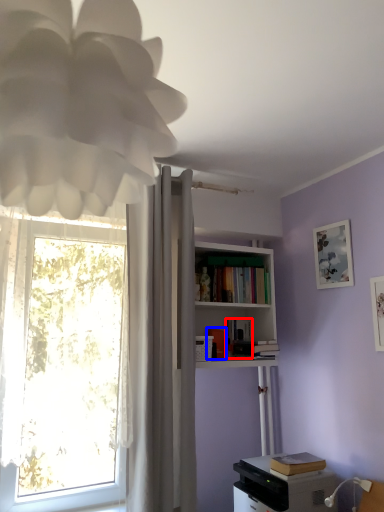
Question: Which point is closer to the camera, book (highlighted by a red box) or book (highlighted by a blue box)?

Choices:
 (A) book
 (B) book

Answer: (B)